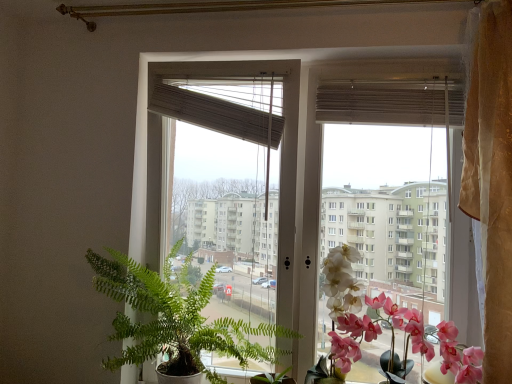
Question: Is matte brown blind at upper center, placed as the second blind when sorted from left to right, to the left or to the right of white matte orchid at right, placed as the 2th flower when sorted from right to left, in the image?

Choices:
 (A) left
 (B) right

Answer: (B)

Question: Is matte brown blind at upper center, placed as the second blind when sorted from left to right, inside or outside of white matte orchid at right, placed as the 2th flower when sorted from right to left?

Choices:
 (A) outside
 (B) inside

Answer: (A)

Question: Estimate the real-world distances between objects in this image. Which object is farther from the beige textured curtain at right?

Choices:
 (A) matte brown blind at upper center, which appears as the first blind when viewed from the right
 (B) pink silk orchid at right, the 1th flower viewed from the right
 (C) green leafy plant at left
 (D) white matte orchid at right, placed as the 2th flower when sorted from right to left
 (E) beige woven blind at upper center, the 2th blind when ordered from right to left

Answer: (C)

Question: Which object is positioned closest to the white matte orchid at right, which is the 1th flower in left-to-right order?

Choices:
 (A) transparent glass window at center
 (B) beige textured curtain at right
 (C) matte brown blind at upper center, placed as the second blind when sorted from left to right
 (D) pink silk orchid at right, the 1th flower viewed from the right
 (E) beige woven blind at upper center, placed as the first blind when sorted from left to right

Answer: (D)